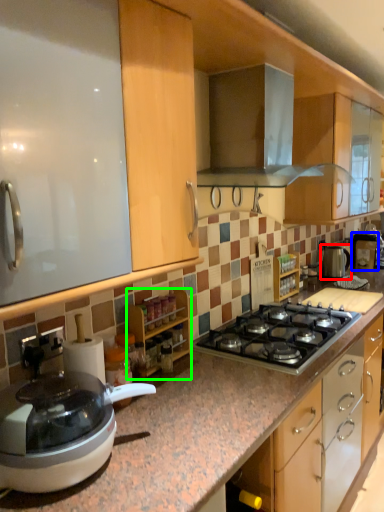
Question: Estimate the real-world distances between objects in this image. Which object is closer to kitchen appliance (highlighted by a red box), coffee machine (highlighted by a blue box) or cabinetry (highlighted by a green box)?

Choices:
 (A) coffee machine
 (B) cabinetry

Answer: (A)